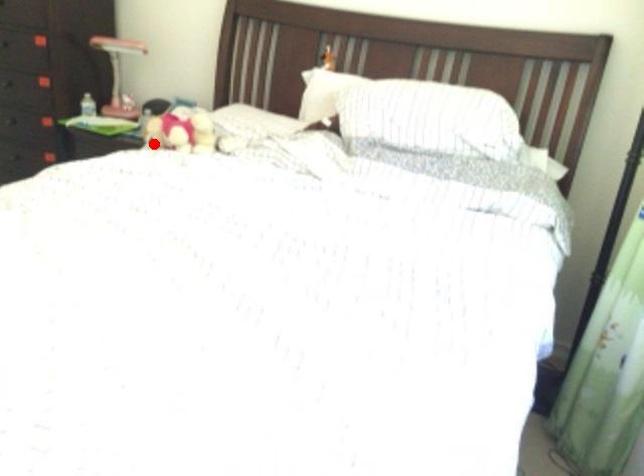
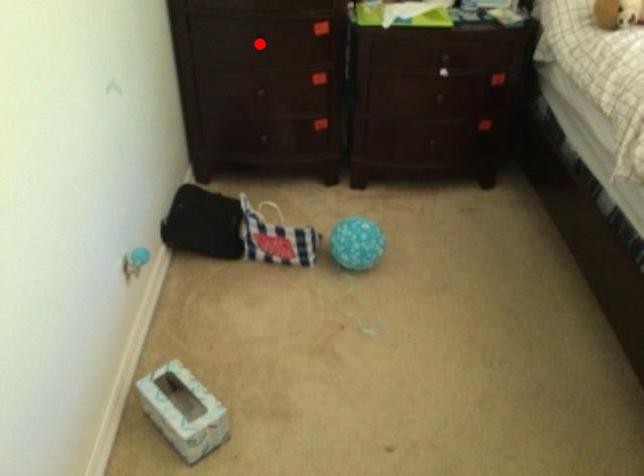
I am providing you with two images of the same scene from different viewpoints. A red point is marked on the first image and another point is marked on the second image. Does the point marked in image1 correspond to the same location as the one in image2?

No